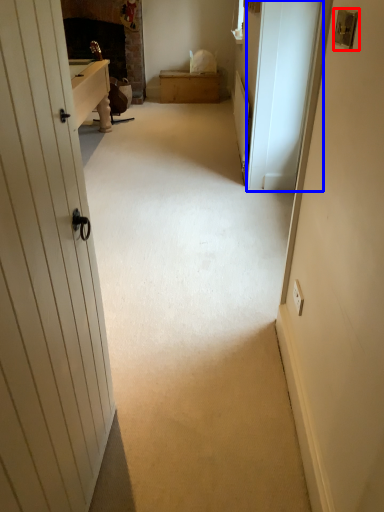
Question: Which object is closer to the camera taking this photo, lock (highlighted by a red box) or screen door (highlighted by a blue box)?

Choices:
 (A) lock
 (B) screen door

Answer: (A)